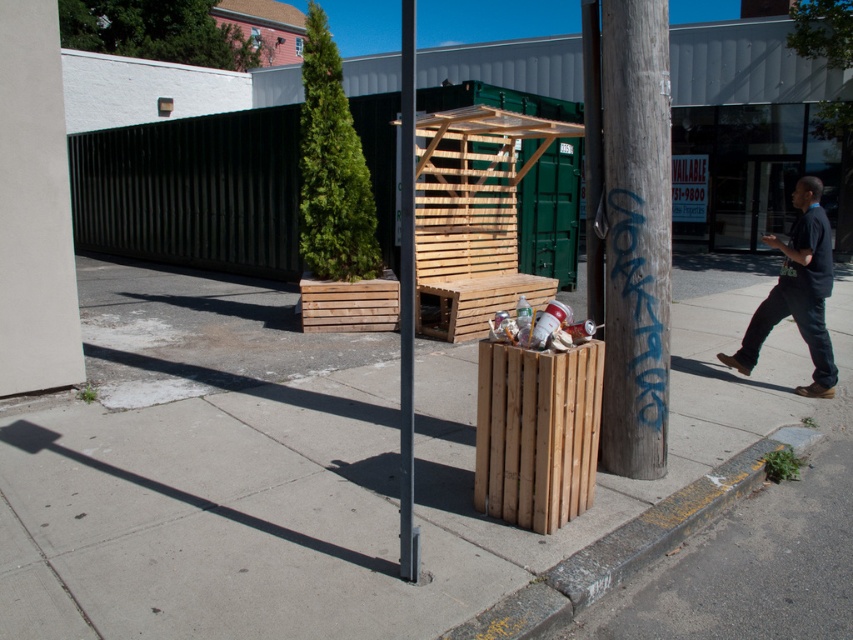
In the scene shown: You are standing at the point closer to the camera between the two points, point 1 at (637, 362) and point 2 at (408, 176). Which point are you standing at?

You are standing at point 2 at (408, 176) because it is closer to the camera compared to point 1 at (637, 362).

You are a delivery person with a cart that is 6 feet wide. You need to move your cart from the wooden crate at center to the concrete curb at lower right. Can your cart fit through the space between them?

The distance between the wooden crate at center and the concrete curb at lower right is 7.01 feet, which is wider than the cart width of 6 feet. Therefore, the cart can fit through the space between them.